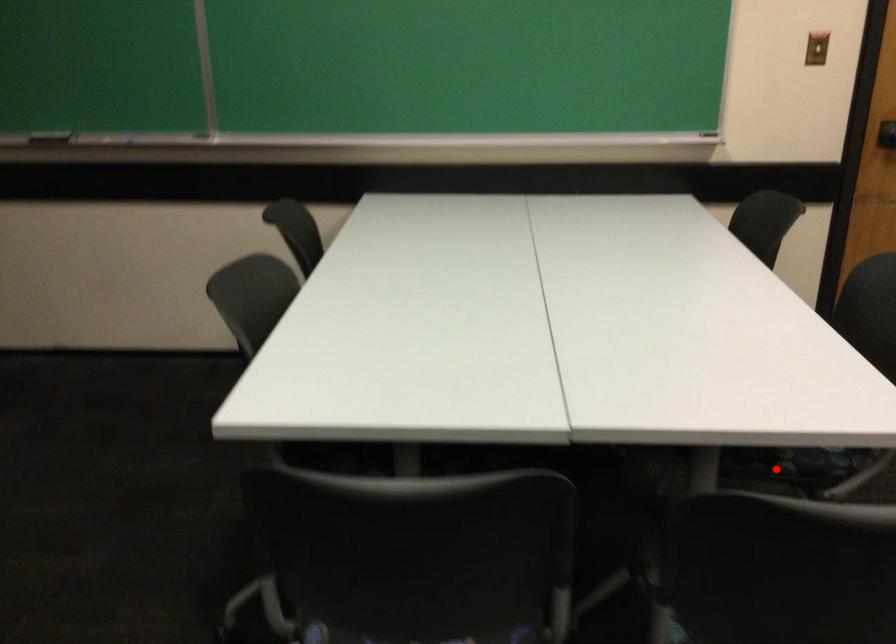
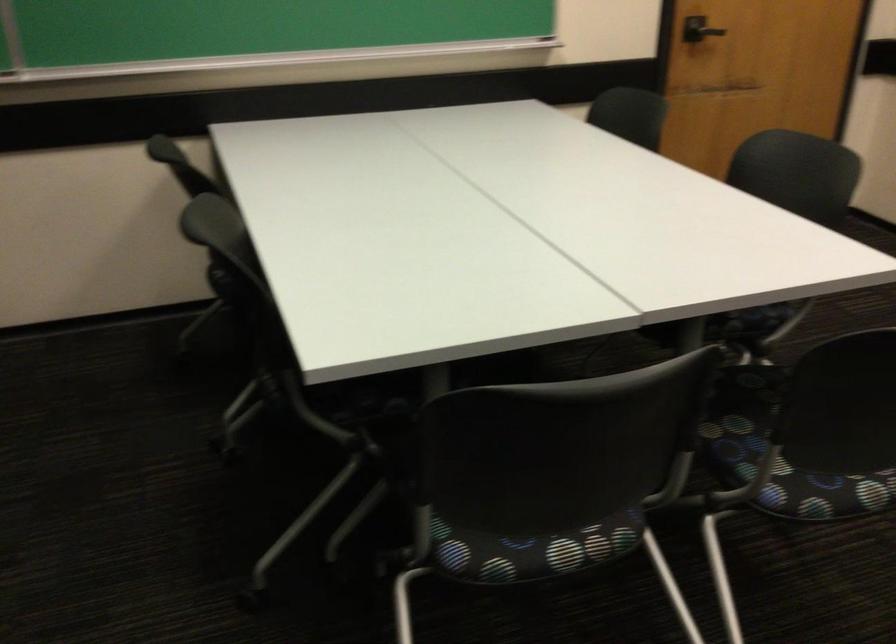
The point at the highlighted location is marked in the first image. Where is the corresponding point in the second image?

(734, 328)